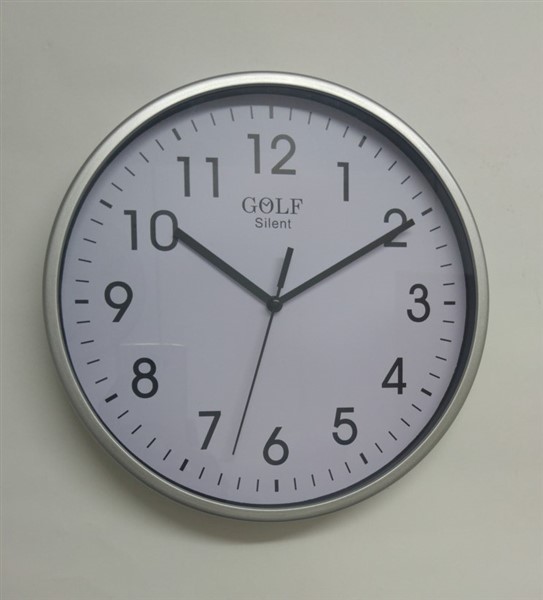
Locate an element on the screen. This screenshot has width=543, height=600. clock face is located at coordinates (303, 358).